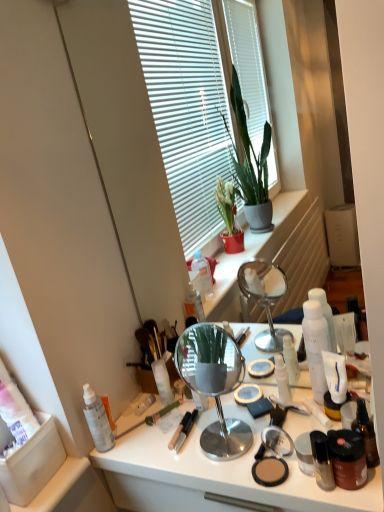
Locate an element on the screen. vacant space in front of white glossy lotion at center, placed as the fifth toiletry when sorted from right to left is located at coordinates (279, 446).